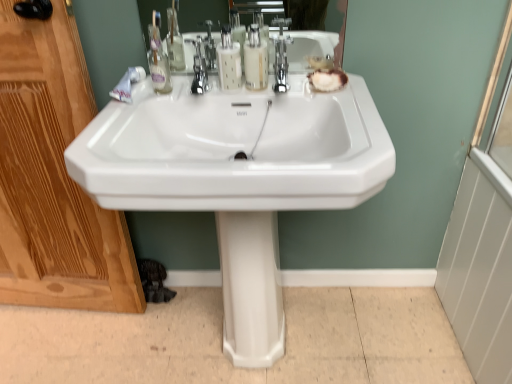
Locate an element on the screen. free location to the right of white glossy pedestal at center is located at coordinates (319, 334).